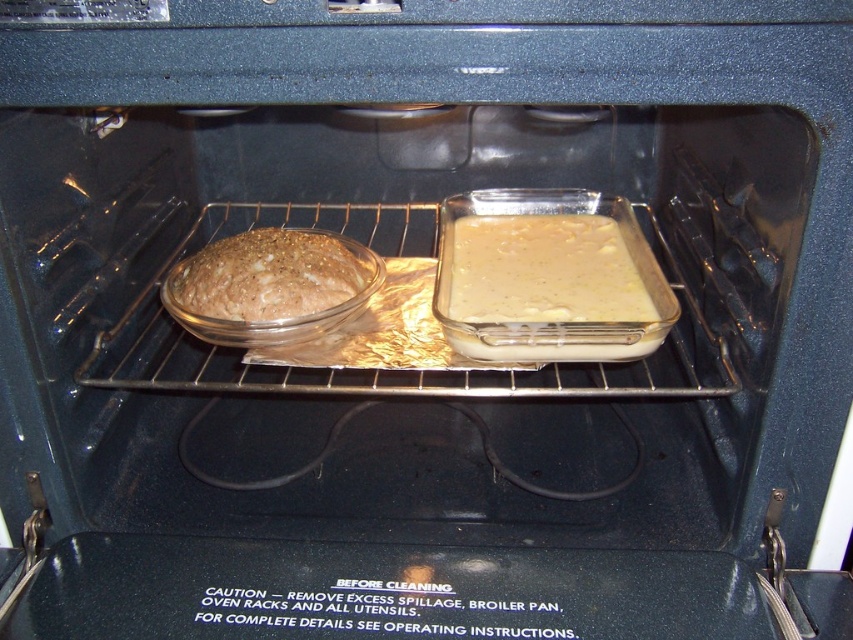
You are a baker checking the oven. You have two items inside the oven, the yellow matte cake at center and the brown matte bread at center. Which one takes up more space in the oven?

The yellow matte cake at center is bigger than the brown matte bread at center, so it takes up more space in the oven.

You are a baker who needs to check the baking progress of both the yellow matte cake at center and the brown matte bread at center in the oven. If you open the oven door, which one will you see first when looking from the front?

The brown matte bread at center will be seen first because the yellow matte cake at center is positioned to its right side, meaning the bread is closer to the oven door.

You are standing in front of an open oven and see two points inside. The first point is at coordinate point (x=537, y=291) and the second is at point (x=291, y=252). Which point is closer to you?

Point (x=537, y=291) is closer to you than point (x=291, y=252) because it is further to the viewer.